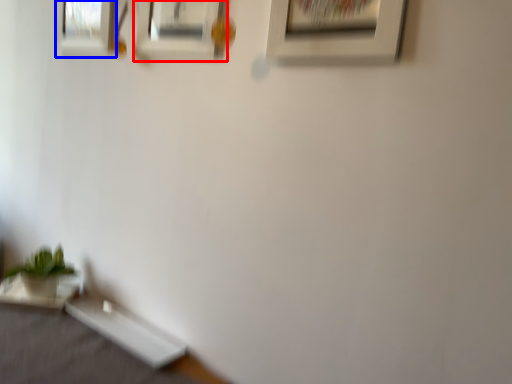
Question: Which point is closer to the camera, picture frame (highlighted by a red box) or picture frame (highlighted by a blue box)?

Choices:
 (A) picture frame
 (B) picture frame

Answer: (A)